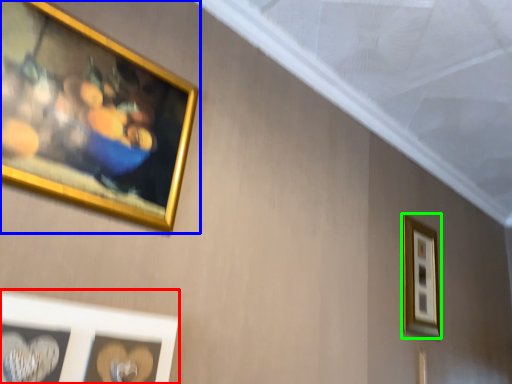
Question: Considering the real-world distances, which object is farthest from picture frame (highlighted by a red box)? picture frame (highlighted by a blue box) or picture frame (highlighted by a green box)?

Choices:
 (A) picture frame
 (B) picture frame

Answer: (B)